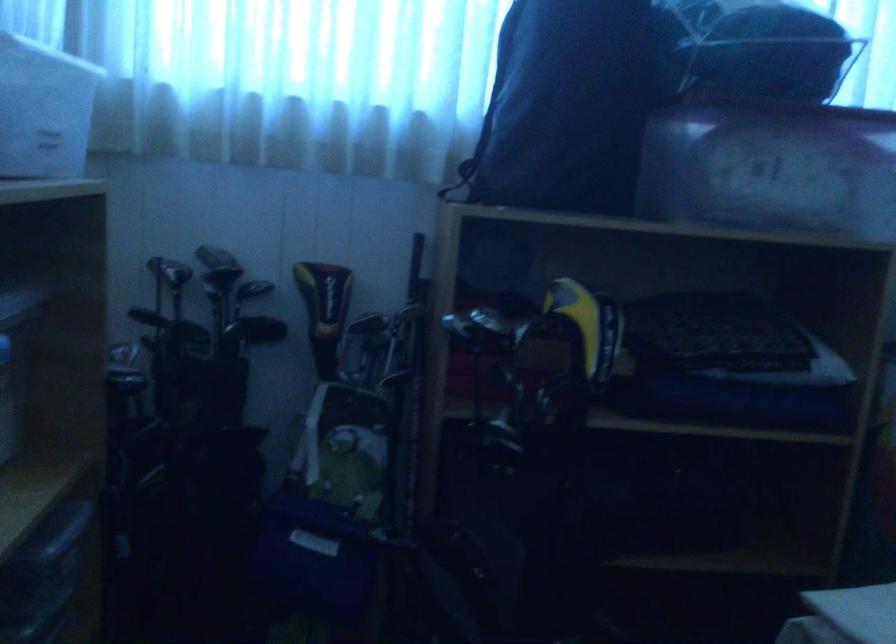
This screenshot has width=896, height=644. I want to click on white bin handle, so click(65, 529).